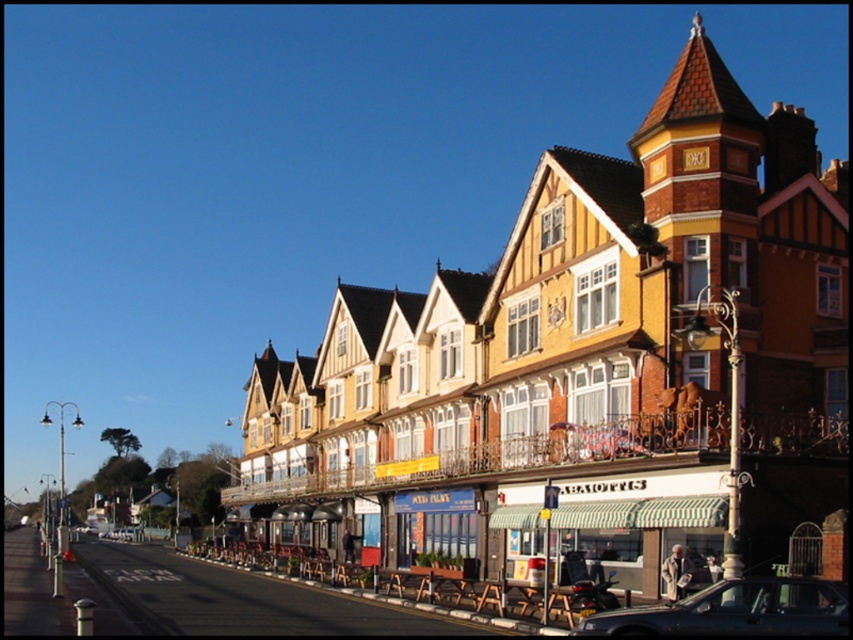
Consider the image. Does yellow wooden building at center have a lesser height compared to metallic blue sedan at center?

In fact, yellow wooden building at center may be taller than metallic blue sedan at center.

Is yellow wooden building at center bigger than metallic blue sedan at center?

Yes.

Is point (781, 268) behind point (811, 595)?

Yes, it is behind point (811, 595).

The image size is (853, 640). Find the location of `yellow wooden building at center`. yellow wooden building at center is located at coordinates (585, 364).

Which is behind, point (839, 196) or point (643, 516)?

The point (839, 196) is more distant.

At what (x,y) coordinates should I click in order to perform the action: click on yellow wooden building at center. Please return your answer as a coordinate pair (x, y). The width and height of the screenshot is (853, 640). Looking at the image, I should click on (585, 364).

This screenshot has width=853, height=640. Find the location of `white striped awning at center`. white striped awning at center is located at coordinates (639, 518).

What do you see at coordinates (639, 518) in the screenshot?
I see `white striped awning at center` at bounding box center [639, 518].

Where is `white striped awning at center`? Image resolution: width=853 pixels, height=640 pixels. white striped awning at center is located at coordinates (639, 518).